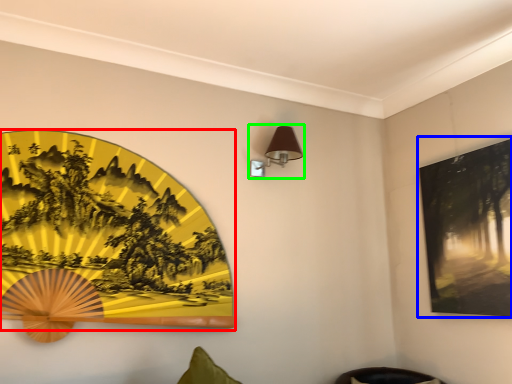
Question: Which object is the farthest from picture frame (highlighted by a red box)? Choose among these: picture frame (highlighted by a blue box) or table lamp (highlighted by a green box).

Choices:
 (A) picture frame
 (B) table lamp

Answer: (A)